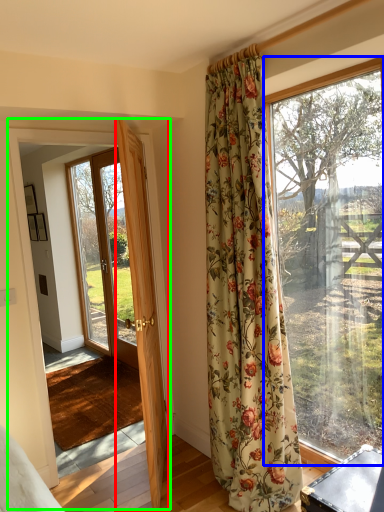
Question: Considering the real-world distances, which object is farthest from door (highlighted by a red box)? window (highlighted by a blue box) or barn door (highlighted by a green box)?

Choices:
 (A) window
 (B) barn door

Answer: (A)